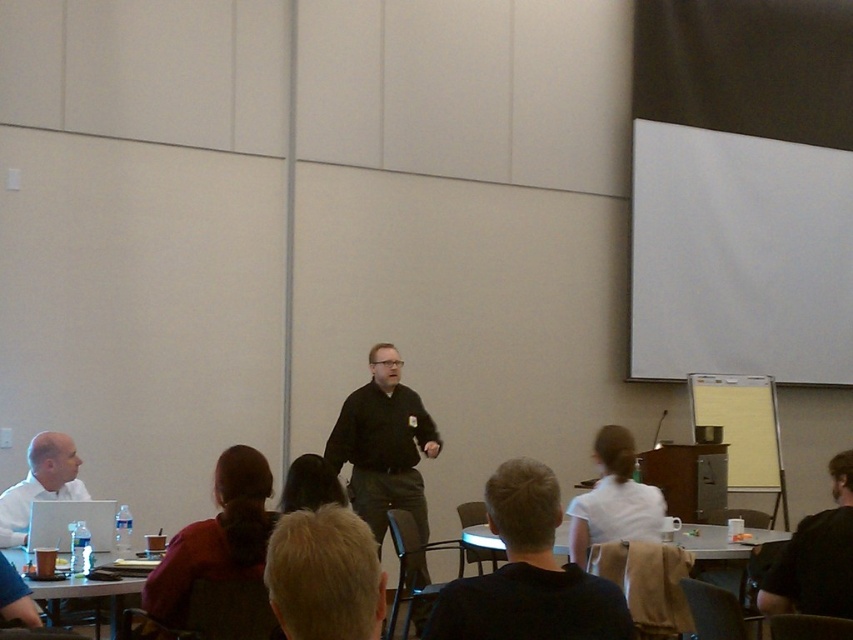
From the picture: In the classroom scene, there is a point marked at coordinates (216, 538). This point corresponds to an object in the scene. Which object is located at this point?

The point at coordinates (216, 538) marks the dark red shirt at lower left.

You are a photographer standing at the camera position. You want to take a photo of the white matte projection screen at upper right. Is the screen within the camera range of 8 meters?

The white matte projection screen at upper right and camera are 7.51 meters apart, so yes, the screen is within the camera range of 8 meters.